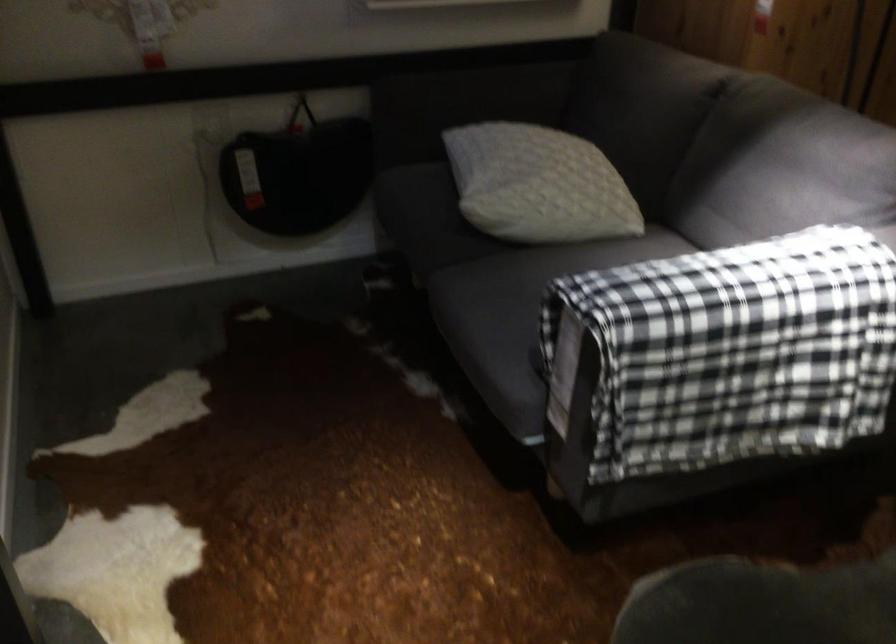
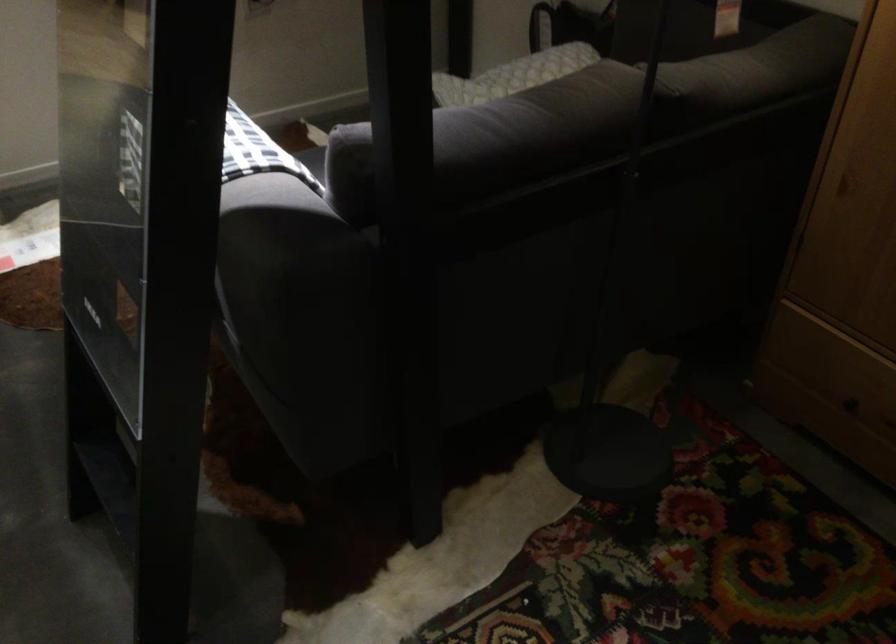
Locate, in the second image, the point that corresponds to pixel 538 147 in the first image.

(528, 68)